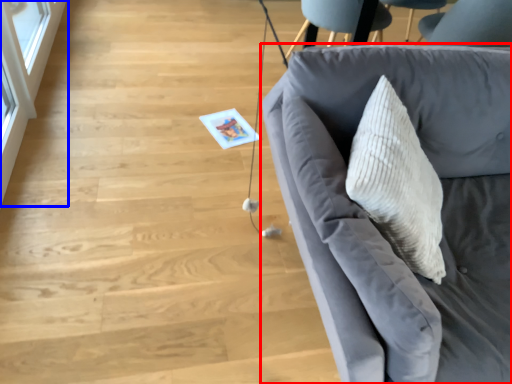
Question: Among these objects, which one is nearest to the camera, studio couch (highlighted by a red box) or glass door (highlighted by a blue box)?

Choices:
 (A) studio couch
 (B) glass door

Answer: (A)